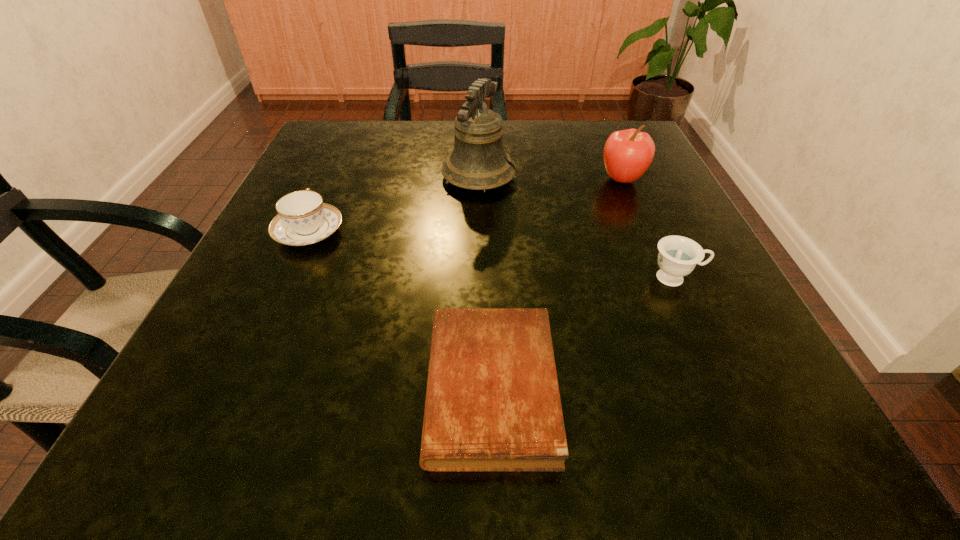
Find the location of `the tallest object`. the tallest object is located at coordinates (478, 161).

Locate an element on the screen. The height and width of the screenshot is (540, 960). apple is located at coordinates (627, 155).

The image size is (960, 540). In order to click on the leftmost object in this screenshot , I will do `click(303, 219)`.

Locate an element on the screen. the farther teacup is located at coordinates (303, 219).

Identify the location of the nearer teacup. (678, 256).

You are a GUI agent. You are given a task and a screenshot of the screen. Output one action in this format:
    pyautogui.click(x=<x>, y=<y>)
    Task: Click on the fourth farthest object
    
    Given the screenshot: What is the action you would take?
    pyautogui.click(x=678, y=256)

At what (x,y) coordinates should I click in order to perform the action: click on Bible. Please return your answer as a coordinate pair (x, y). The width and height of the screenshot is (960, 540). Looking at the image, I should click on (493, 404).

At what (x,y) coordinates should I click in order to perform the action: click on the shortest object. Please return your answer as a coordinate pair (x, y). The height and width of the screenshot is (540, 960). Looking at the image, I should click on (493, 404).

Find the location of a particular element. free space located on the left of the tallest object is located at coordinates (417, 177).

At what (x,y) coordinates should I click in order to perform the action: click on vacant space located on the right of the apple. Please return your answer as a coordinate pair (x, y). The width and height of the screenshot is (960, 540). Looking at the image, I should click on (670, 179).